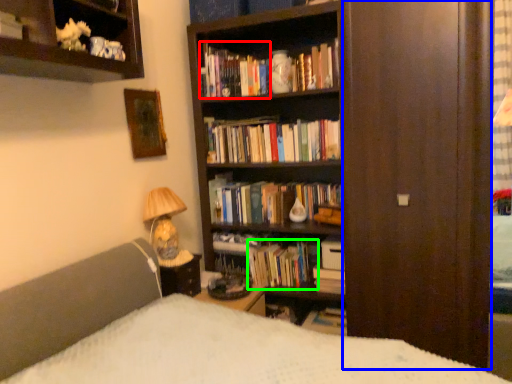
Question: Which object is the farthest from book (highlighted by a red box)? Choose among these: screen door (highlighted by a blue box) or book (highlighted by a green box).

Choices:
 (A) screen door
 (B) book

Answer: (B)